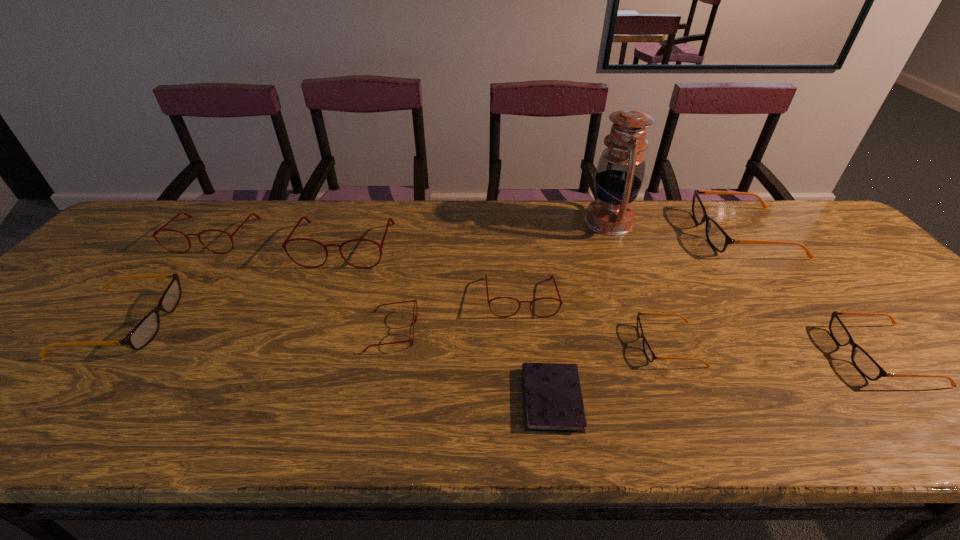
At what (x,y) coordinates should I click in order to perform the action: click on free space located 0.080m on the face of the third biggest red spectacles. Please return your answer as a coordinate pair (x, y). This screenshot has height=540, width=960. Looking at the image, I should click on (525, 343).

Image resolution: width=960 pixels, height=540 pixels. I want to click on free spot located on the front-facing side of the third smallest black spectacles, so click(x=253, y=322).

Image resolution: width=960 pixels, height=540 pixels. Find the location of `vacant region located 0.250m on the face of the smallest red spectacles`. vacant region located 0.250m on the face of the smallest red spectacles is located at coordinates (522, 331).

Where is `vacant space located 0.060m on the front-facing side of the second smallest black spectacles`? This screenshot has height=540, width=960. vacant space located 0.060m on the front-facing side of the second smallest black spectacles is located at coordinates (815, 355).

Locate an element on the screen. The image size is (960, 540). vacant space located on the front-facing side of the second smallest black spectacles is located at coordinates (715, 355).

Find the location of a particular element. This screenshot has width=960, height=540. vacant area situated 0.120m on the front-facing side of the second smallest black spectacles is located at coordinates (787, 355).

Image resolution: width=960 pixels, height=540 pixels. I want to click on vacant space located on the front-facing side of the second black spectacles from left to right, so click(x=524, y=344).

The image size is (960, 540). In order to click on vacant space located on the front-facing side of the second black spectacles from left to right in this screenshot , I will do `click(608, 344)`.

Image resolution: width=960 pixels, height=540 pixels. In order to click on vacant area situated on the front-facing side of the second black spectacles from left to right in this screenshot , I will do `click(533, 344)`.

I want to click on vacant space located on the back of the shortest object, so click(x=535, y=280).